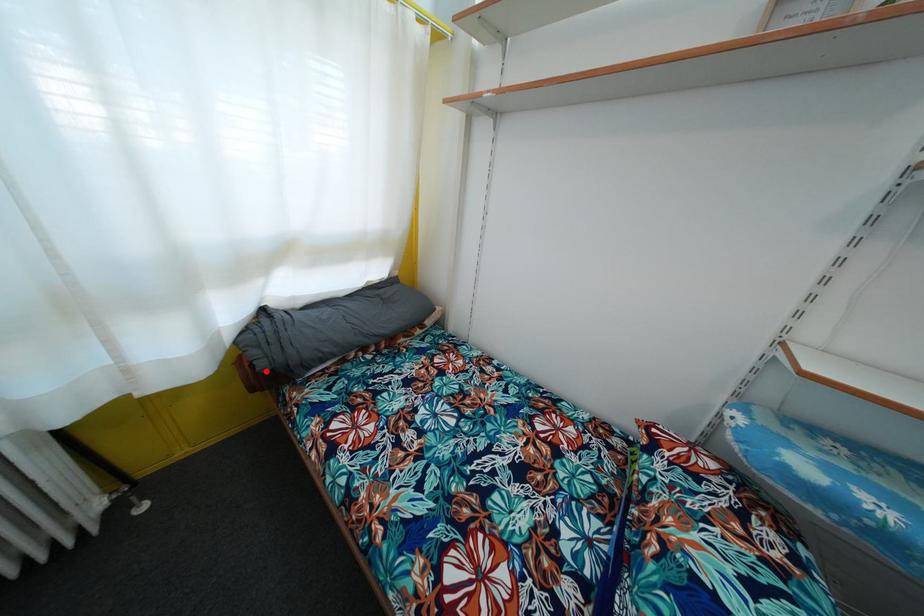
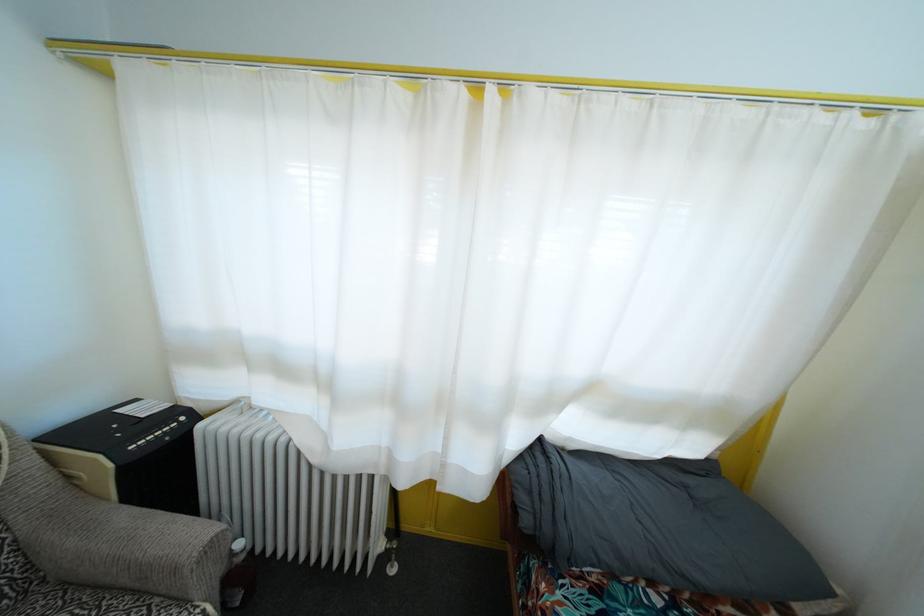
Where in the second image is the point corresponding to the highlighted location from the first image?

(529, 528)